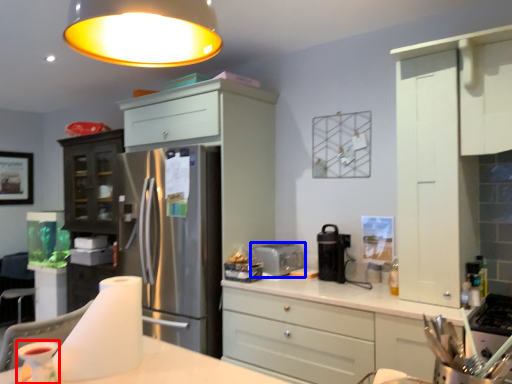
Question: Which of the following is the closest to the observer, appliance (highlighted by a red box) or toaster (highlighted by a blue box)?

Choices:
 (A) appliance
 (B) toaster

Answer: (A)